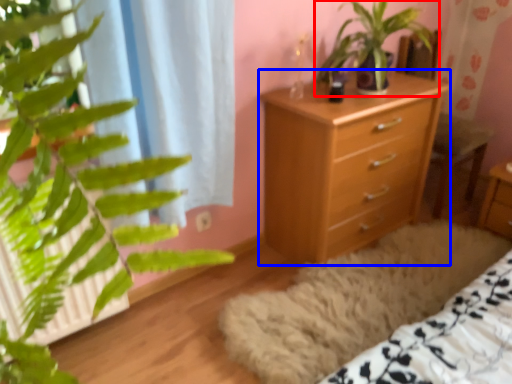
Question: Which of the following is the farthest to the observer, houseplant (highlighted by a red box) or chest of drawers (highlighted by a blue box)?

Choices:
 (A) houseplant
 (B) chest of drawers

Answer: (B)